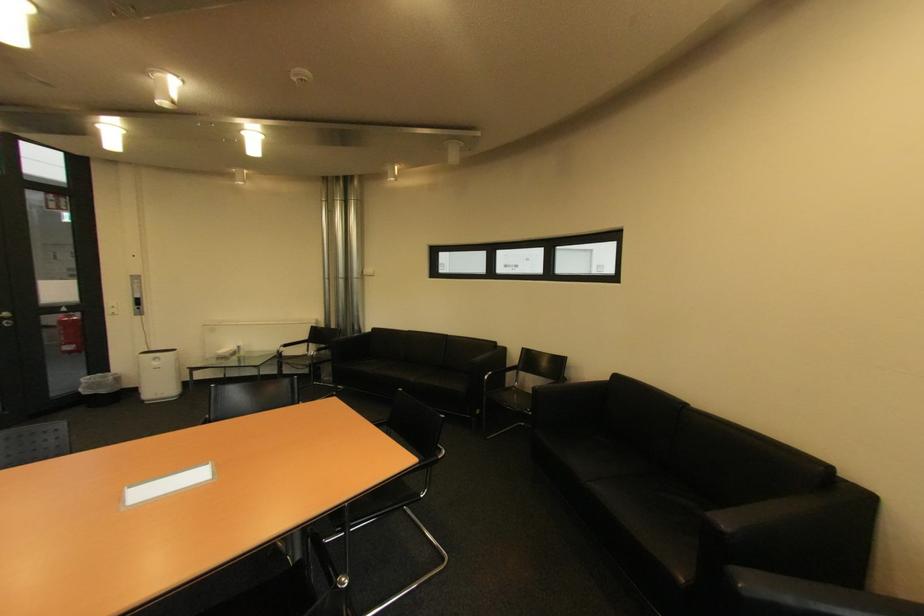
Find where to rest the chair armrest. Please return your answer as a coordinate pair (x, y).

(499, 376)